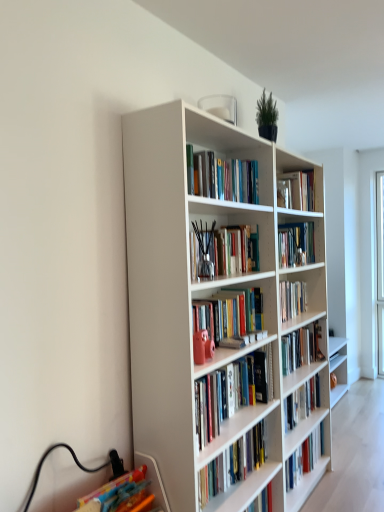
The width and height of the screenshot is (384, 512). In order to click on hardcover books at upper center, the second book when ordered from top to bottom in this screenshot , I will do `click(223, 177)`.

In order to face hardcover books at upper center, the second book when ordered from top to bottom, should I rotate leftwards or rightwards?

You should rotate right by 2.665 degrees.

This screenshot has width=384, height=512. In order to click on hardcover book at upper center, which appears as the fourth book when ordered from the bottom in this screenshot , I will do `click(296, 190)`.

What do you see at coordinates (296, 190) in the screenshot?
I see `hardcover book at upper center, which appears as the fourth book when ordered from the bottom` at bounding box center [296, 190].

What is the approximate height of translucent glass vase at center, the 2th book in the bottom-to-top sequence?

It is 9.85 inches.

This screenshot has height=512, width=384. In order to click on white matte bookcase at center in this screenshot , I will do `click(223, 322)`.

Which is less distant, (224, 407) or (230, 191)?

The point (224, 407) is more forward.

The width and height of the screenshot is (384, 512). In order to click on the 1st book behind the white glossy bookshelf at center, which is the 4th book in top-to-bottom order in this screenshot , I will do `click(223, 177)`.

Is there a large distance between white glossy bookshelf at center, which is the 4th book in top-to-bottom order, and hardcover books at upper center, which is counted as the third book, starting from the bottom?

white glossy bookshelf at center, which is the 4th book in top-to-bottom order, is near hardcover books at upper center, which is counted as the third book, starting from the bottom, not far away.

From a real-world perspective, is white glossy bookshelf at center, arranged as the 1th book when ordered from the bottom, physically located above or below hardcover books at upper center, the second book when ordered from top to bottom?

From a real-world perspective, white glossy bookshelf at center, arranged as the 1th book when ordered from the bottom, is physically below hardcover books at upper center, the second book when ordered from top to bottom.

Considering the relative positions of hardcover books at upper center, which is counted as the third book, starting from the bottom, and white glossy bookshelf at center, arranged as the 1th book when ordered from the bottom, in the image provided, is hardcover books at upper center, which is counted as the third book, starting from the bottom, to the left of white glossy bookshelf at center, arranged as the 1th book when ordered from the bottom, from the viewer's perspective?

Correct, you'll find hardcover books at upper center, which is counted as the third book, starting from the bottom, to the left of white glossy bookshelf at center, arranged as the 1th book when ordered from the bottom.

Measure the distance from hardcover books at upper center, which is counted as the third book, starting from the bottom, to white glossy bookshelf at center, which is the 4th book in top-to-bottom order.

They are 33.03 inches apart.

Is hardcover books at upper center, which is counted as the third book, starting from the bottom, not within white glossy bookshelf at center, arranged as the 1th book when ordered from the bottom?

Yes, hardcover books at upper center, which is counted as the third book, starting from the bottom, is not within white glossy bookshelf at center, arranged as the 1th book when ordered from the bottom.

From the image's perspective, would you say hardcover books at upper center, the second book when ordered from top to bottom, is shown under white glossy bookshelf at center, which is the 4th book in top-to-bottom order?

Actually, hardcover books at upper center, the second book when ordered from top to bottom, appears above white glossy bookshelf at center, which is the 4th book in top-to-bottom order, in the image.

Which object is wider, hardcover books at upper center, the second book when ordered from top to bottom, or translucent glass vase at center, which is counted as the third book, starting from the top?

translucent glass vase at center, which is counted as the third book, starting from the top.

Is hardcover books at upper center, which is counted as the third book, starting from the bottom, directly adjacent to translucent glass vase at center, the 2th book in the bottom-to-top sequence?

No, hardcover books at upper center, which is counted as the third book, starting from the bottom, is not touching translucent glass vase at center, the 2th book in the bottom-to-top sequence.

From the picture: Would you say hardcover books at upper center, the second book when ordered from top to bottom, contains translucent glass vase at center, which is counted as the third book, starting from the top?

Definitely not — translucent glass vase at center, which is counted as the third book, starting from the top, is not inside hardcover books at upper center, the second book when ordered from top to bottom.

Which is more to the left, hardcover books at upper center, which is counted as the third book, starting from the bottom, or translucent glass vase at center, which is counted as the third book, starting from the top?

translucent glass vase at center, which is counted as the third book, starting from the top, is more to the left.

Based on the photo, can you tell me how much white glossy bookshelf at center, which is the 4th book in top-to-bottom order, and hardcover book at upper center, the 1th book viewed from the top, differ in facing direction?

1.36 degrees.

Which of these two, white glossy bookshelf at center, which is the 4th book in top-to-bottom order, or hardcover book at upper center, the 1th book viewed from the top, is smaller?

hardcover book at upper center, the 1th book viewed from the top, is smaller.

Considering the positions of objects white glossy bookshelf at center, arranged as the 1th book when ordered from the bottom, and hardcover book at upper center, which appears as the fourth book when ordered from the bottom, in the image provided, who is more to the right, white glossy bookshelf at center, arranged as the 1th book when ordered from the bottom, or hardcover book at upper center, which appears as the fourth book when ordered from the bottom,?

From the viewer's perspective, hardcover book at upper center, which appears as the fourth book when ordered from the bottom, appears more on the right side.

Relative to white glossy bookshelf at center, which is the 4th book in top-to-bottom order, is hardcover book at upper center, the 1th book viewed from the top, in front or behind?

hardcover book at upper center, the 1th book viewed from the top, is positioned farther from the viewer than white glossy bookshelf at center, which is the 4th book in top-to-bottom order.

From a real-world perspective, is hardcover book at upper center, which appears as the fourth book when ordered from the bottom, on white glossy bookshelf at center, which is the 4th book in top-to-bottom order?

Correct, in the physical world, hardcover book at upper center, which appears as the fourth book when ordered from the bottom, is higher than white glossy bookshelf at center, which is the 4th book in top-to-bottom order.

Which of these two, hardcover book at upper center, the 1th book viewed from the top, or white glossy bookshelf at center, which is the 4th book in top-to-bottom order, is smaller?

Smaller between the two is hardcover book at upper center, the 1th book viewed from the top.

Would you say hardcover book at upper center, the 1th book viewed from the top, is to the left or to the right of white glossy bookshelf at center, arranged as the 1th book when ordered from the bottom, in the picture?

Clearly, hardcover book at upper center, the 1th book viewed from the top, is on the right of white glossy bookshelf at center, arranged as the 1th book when ordered from the bottom, in the image.

Could you measure the distance between hardcover book at upper center, which appears as the fourth book when ordered from the bottom, and white matte bookcase at center?

hardcover book at upper center, which appears as the fourth book when ordered from the bottom, and white matte bookcase at center are 28.53 inches apart from each other.

Could you tell me if hardcover book at upper center, the 1th book viewed from the top, is facing white matte bookcase at center?

Yes.

From a real-world perspective, between hardcover book at upper center, the 1th book viewed from the top, and white matte bookcase at center, who is vertically higher?

hardcover book at upper center, the 1th book viewed from the top.

You are a GUI agent. You are given a task and a screenshot of the screen. Output one action in this format:
    pyautogui.click(x=<x>, y=<y>)
    Task: Click on the bookcase below the hardcover book at upper center, which appears as the fourth book when ordered from the bottom (from the image's perspective)
    This screenshot has height=512, width=384.
    Given the screenshot: What is the action you would take?
    pyautogui.click(x=223, y=322)

Is point (159, 164) positioned after point (216, 261)?

No, (159, 164) is in front of (216, 261).

Consider the image. From a real-world perspective, is white matte bookcase at center positioned above or below translucent glass vase at center, the 2th book in the bottom-to-top sequence?

From a real-world perspective, white matte bookcase at center is physically below translucent glass vase at center, the 2th book in the bottom-to-top sequence.

Could you measure the distance between white matte bookcase at center and translucent glass vase at center, the 2th book in the bottom-to-top sequence?

They are 17.42 inches apart.

From the image's perspective, is white matte bookcase at center on translucent glass vase at center, which is counted as the third book, starting from the top?

Actually, white matte bookcase at center appears below translucent glass vase at center, which is counted as the third book, starting from the top, in the image.

Where is `the 2nd book above the white glossy bookshelf at center, arranged as the 1th book when ordered from the bottom (from the image's perspective)`? The height and width of the screenshot is (512, 384). the 2nd book above the white glossy bookshelf at center, arranged as the 1th book when ordered from the bottom (from the image's perspective) is located at coordinates (223, 177).

Locate an element on the screen. Image resolution: width=384 pixels, height=512 pixels. the 1st book to the left when counting from the white glossy bookshelf at center, which is the 4th book in top-to-bottom order is located at coordinates (223, 177).

Based on their spatial positions, is hardcover books at upper center, which is counted as the third book, starting from the bottom, or translucent glass vase at center, the 2th book in the bottom-to-top sequence, closer to white glossy bookshelf at center, which is the 4th book in top-to-bottom order?

Based on the image, translucent glass vase at center, the 2th book in the bottom-to-top sequence, appears to be nearer to white glossy bookshelf at center, which is the 4th book in top-to-bottom order.

Considering their positions, is hardcover books at upper center, which is counted as the third book, starting from the bottom, positioned further to white matte bookcase at center than white glossy bookshelf at center, arranged as the 1th book when ordered from the bottom?

Among the two, hardcover books at upper center, which is counted as the third book, starting from the bottom, is located further to white matte bookcase at center.

Consider the image. Considering their positions, is translucent glass vase at center, the 2th book in the bottom-to-top sequence, positioned closer to hardcover books at upper center, which is counted as the third book, starting from the bottom, than hardcover book at upper center, which appears as the fourth book when ordered from the bottom?

The object closer to hardcover books at upper center, which is counted as the third book, starting from the bottom, is translucent glass vase at center, the 2th book in the bottom-to-top sequence.

In the scene shown: Considering their positions, is translucent glass vase at center, the 2th book in the bottom-to-top sequence, positioned further to hardcover books at upper center, which is counted as the third book, starting from the bottom, than white matte bookcase at center?

white matte bookcase at center lies further to hardcover books at upper center, which is counted as the third book, starting from the bottom, than the other object.

Which object lies further to the anchor point hardcover book at upper center, which appears as the fourth book when ordered from the bottom, white glossy bookshelf at center, which is the 4th book in top-to-bottom order, or white matte bookcase at center?

white glossy bookshelf at center, which is the 4th book in top-to-bottom order, is positioned further to the anchor hardcover book at upper center, which appears as the fourth book when ordered from the bottom.

Based on their spatial positions, is hardcover books at upper center, the second book when ordered from top to bottom, or white glossy bookshelf at center, which is the 4th book in top-to-bottom order, closer to translucent glass vase at center, which is counted as the third book, starting from the top?

The object closer to translucent glass vase at center, which is counted as the third book, starting from the top, is hardcover books at upper center, the second book when ordered from top to bottom.

Estimate the real-world distances between objects in this image. Which object is further from white matte bookcase at center, hardcover book at upper center, which appears as the fourth book when ordered from the bottom, or white glossy bookshelf at center, which is the 4th book in top-to-bottom order?

hardcover book at upper center, which appears as the fourth book when ordered from the bottom.

From the image, which object appears to be farther from translucent glass vase at center, the 2th book in the bottom-to-top sequence, hardcover book at upper center, the 1th book viewed from the top, or hardcover books at upper center, the second book when ordered from top to bottom?

hardcover book at upper center, the 1th book viewed from the top.

Find the location of a particular element. This screenshot has width=384, height=512. bookcase between translucent glass vase at center, which is counted as the third book, starting from the top, and white glossy bookshelf at center, arranged as the 1th book when ordered from the bottom, in the vertical direction is located at coordinates (223, 322).

Locate an element on the screen. The height and width of the screenshot is (512, 384). book that lies between hardcover books at upper center, which is counted as the third book, starting from the bottom, and white matte bookcase at center from top to bottom is located at coordinates (226, 251).

This screenshot has width=384, height=512. In order to click on book between hardcover books at upper center, which is counted as the third book, starting from the bottom, and white glossy bookshelf at center, arranged as the 1th book when ordered from the bottom, from top to bottom in this screenshot , I will do `click(226, 251)`.

I want to click on bookcase between hardcover books at upper center, the second book when ordered from top to bottom, and white glossy bookshelf at center, which is the 4th book in top-to-bottom order, vertically, so click(223, 322).